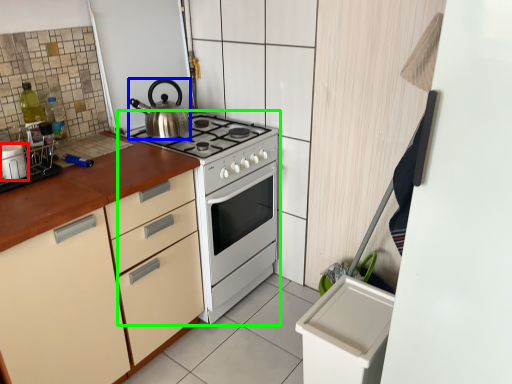
Question: Which object is the farthest from kitchen appliance (highlighted by a red box)? Choose among these: kettle (highlighted by a blue box) or appliance (highlighted by a green box).

Choices:
 (A) kettle
 (B) appliance

Answer: (B)